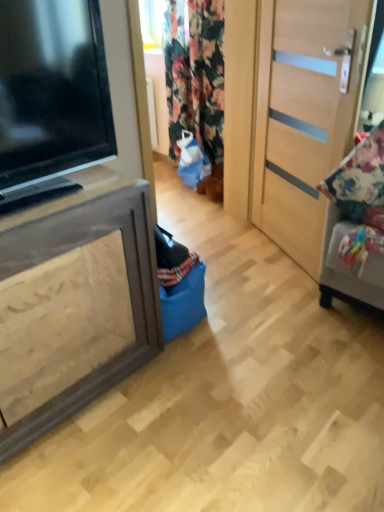
I want to click on vacant space underneath light wood door at right (from a real-world perspective), so click(x=278, y=249).